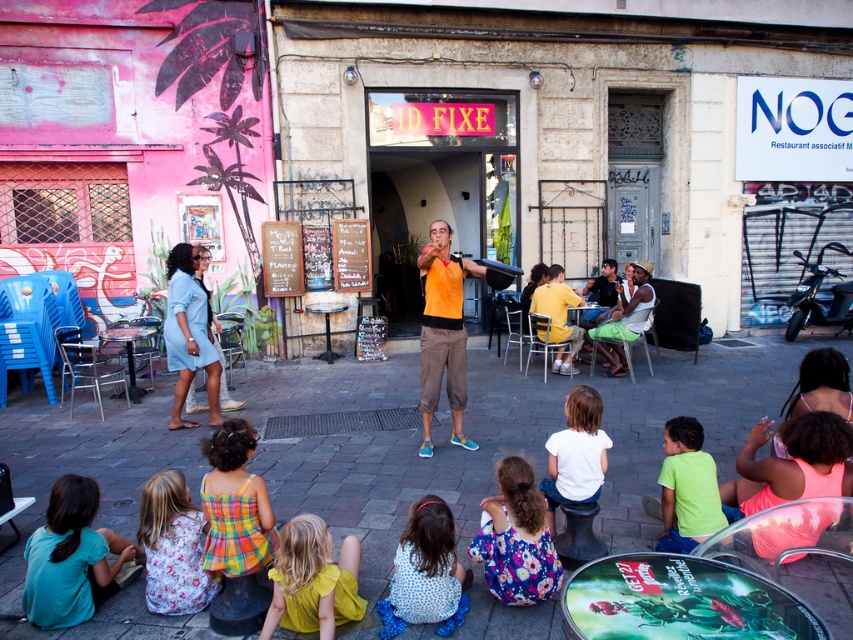
Can you confirm if neon green t-shirt at lower right is bigger than matte orange shirt at center?

No, neon green t-shirt at lower right is not bigger than matte orange shirt at center.

Does neon green t-shirt at lower right appear on the left side of matte orange shirt at center?

Yes, neon green t-shirt at lower right is to the left of matte orange shirt at center.

Image resolution: width=853 pixels, height=640 pixels. What do you see at coordinates (686, 486) in the screenshot?
I see `neon green t-shirt at lower right` at bounding box center [686, 486].

Identify the location of neon green t-shirt at lower right. (686, 486).

Is point (672, 488) more distant than point (579, 323)?

That is False.

Between neon green t-shirt at lower right and orange fabric shirt at center, which one has less height?

neon green t-shirt at lower right

What do you see at coordinates (686, 486) in the screenshot? Image resolution: width=853 pixels, height=640 pixels. I see `neon green t-shirt at lower right` at bounding box center [686, 486].

The image size is (853, 640). Identify the location of neon green t-shirt at lower right. (686, 486).

Locate an element on the screen. The image size is (853, 640). teal cotton shirt at lower left is located at coordinates (71, 557).

Find the location of a particular element. teal cotton shirt at lower left is located at coordinates (71, 557).

Where is `teal cotton shirt at lower left`? This screenshot has width=853, height=640. teal cotton shirt at lower left is located at coordinates (71, 557).